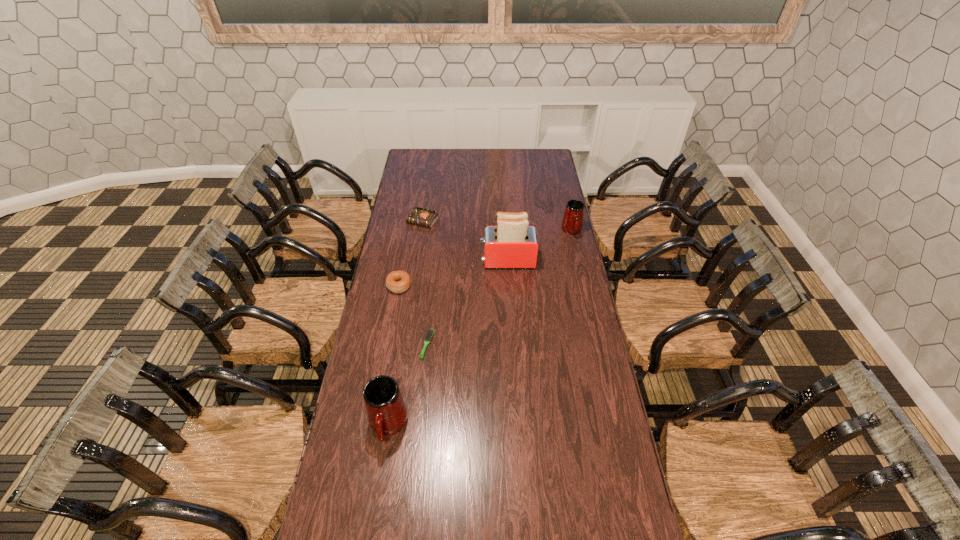
I want to click on object at the right edge, so click(572, 223).

Locate an element on the screen. This screenshot has height=540, width=960. vacant region at the far edge of the desktop is located at coordinates (504, 158).

Locate an element on the screen. free point at the near edge is located at coordinates (446, 495).

Where is `free spot at the left edge of the desktop`? This screenshot has width=960, height=540. free spot at the left edge of the desktop is located at coordinates (372, 361).

In the image, there is a desktop. Identify the location of free region at the right edge. The image size is (960, 540). (589, 367).

The image size is (960, 540). What are the coordinates of `free point at the far left corner` in the screenshot? It's located at (413, 156).

This screenshot has width=960, height=540. I want to click on free region at the near right corner, so [602, 512].

The image size is (960, 540). I want to click on free space between the left mug and the diary, so click(405, 324).

This screenshot has height=540, width=960. I want to click on free point between the third farthest object and the hairbrush, so click(468, 303).

Locate an element on the screen. vacant area that lies between the diary and the bagel is located at coordinates (411, 254).